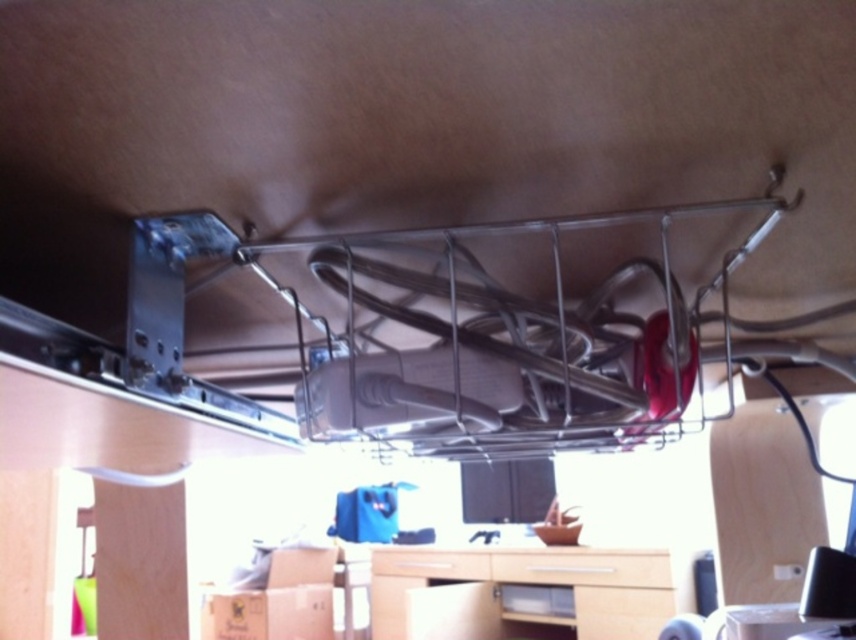
Question: Considering the real-world distances, which object is farthest from the matte wood drawer at center?

Choices:
 (A) light wood/wooden computer desk at lower center
 (B) wooden drawer at center

Answer: (B)

Question: Is light wood/wooden computer desk at lower center wider than wooden drawer at center?

Choices:
 (A) no
 (B) yes

Answer: (B)

Question: Can you confirm if light wood/wooden computer desk at lower center is wider than matte wood drawer at center?

Choices:
 (A) no
 (B) yes

Answer: (B)

Question: Is matte wood drawer at center further to camera compared to wooden drawer at center?

Choices:
 (A) yes
 (B) no

Answer: (B)

Question: Based on their relative distances, which object is nearer to the wooden drawer at center?

Choices:
 (A) matte wood drawer at center
 (B) light wood/wooden computer desk at lower center

Answer: (B)

Question: Which is nearer to the wooden drawer at center?

Choices:
 (A) light wood/wooden computer desk at lower center
 (B) matte wood drawer at center

Answer: (A)